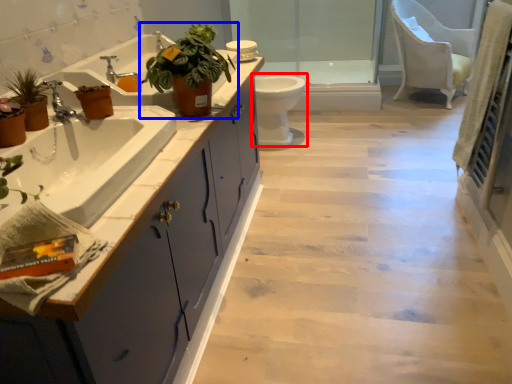
Question: Which of the following is the farthest to the observer, toilet (highlighted by a red box) or houseplant (highlighted by a blue box)?

Choices:
 (A) toilet
 (B) houseplant

Answer: (A)